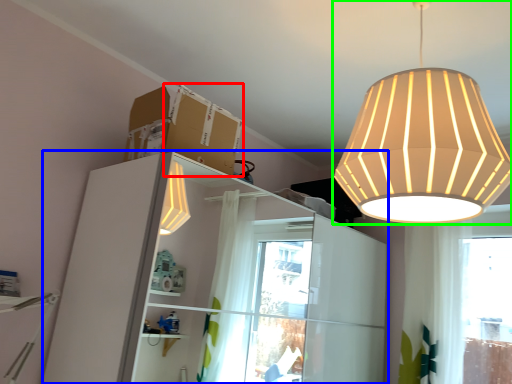
Question: Which object is positioned farthest from cardboard box (highlighted by a red box)? Select from dresser (highlighted by a blue box) and lamp (highlighted by a green box).

Choices:
 (A) dresser
 (B) lamp

Answer: (A)